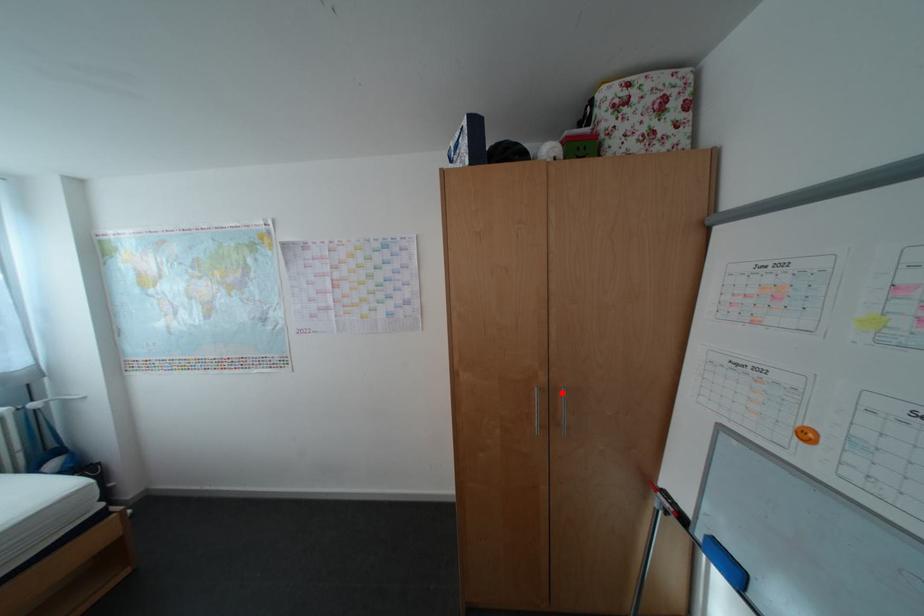
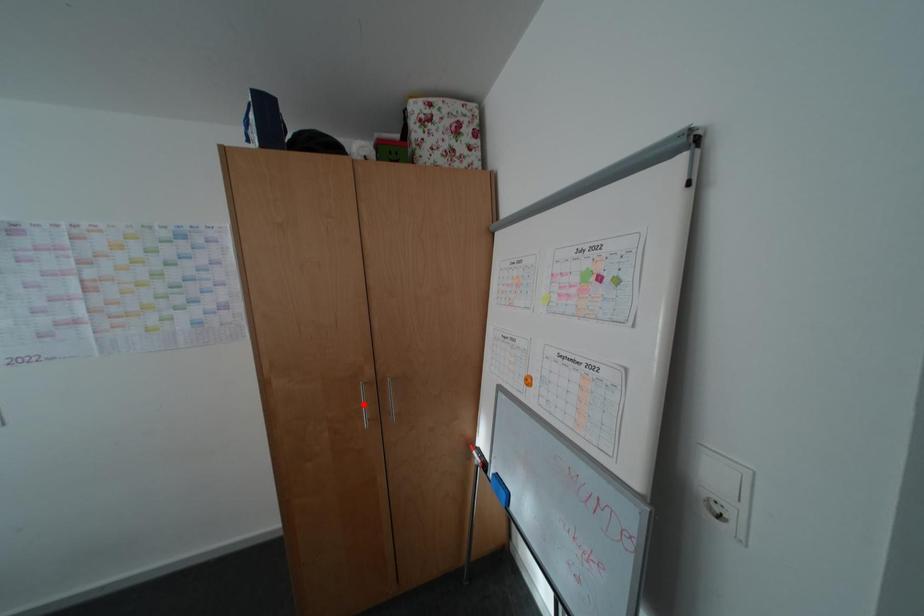
I am providing you with two images of the same scene from different viewpoints. A red point is marked on the first image and another point is marked on the second image. Do the highlighted points in image1 and image2 indicate the same real-world spot?

No